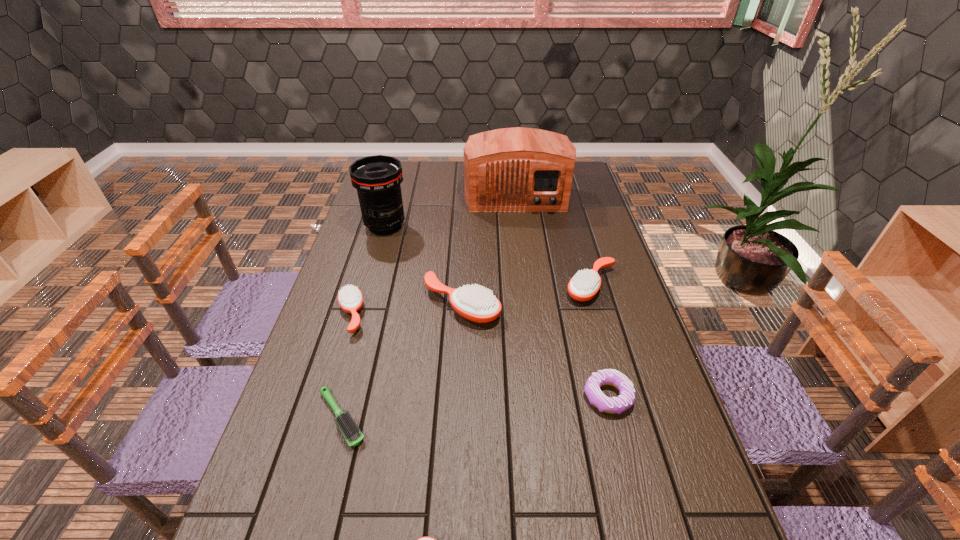
This screenshot has width=960, height=540. Identify the location of the second nearest hairbrush. (349, 429).

Where is `free space located 0.090m on the front-facing side of the radio receiver`? free space located 0.090m on the front-facing side of the radio receiver is located at coordinates (520, 230).

This screenshot has width=960, height=540. Find the location of `vacant space located on the back of the telephoto lens`. vacant space located on the back of the telephoto lens is located at coordinates (395, 193).

At what (x,y) coordinates should I click in order to perform the action: click on vacant space located on the right of the third tallest object. Please return your answer as a coordinate pair (x, y). This screenshot has width=960, height=540. Looking at the image, I should click on (620, 305).

At what (x,y) coordinates should I click in order to perform the action: click on vacant space located on the front of the rightmost hairbrush. Please return your answer as a coordinate pair (x, y). This screenshot has width=960, height=540. Looking at the image, I should click on (619, 384).

Identify the location of vacant region located on the back of the third tallest hairbrush. pos(373,240).

This screenshot has height=540, width=960. Identify the location of free space located on the right of the purple doughnut. (658, 396).

Locate an element on the screen. The width and height of the screenshot is (960, 540). vacant point located on the front of the shortest object is located at coordinates (327, 472).

What are the coordinates of `object present at the far edge` in the screenshot? It's located at (518, 169).

Image resolution: width=960 pixels, height=540 pixels. I want to click on telephoto lens that is at the left edge, so click(377, 179).